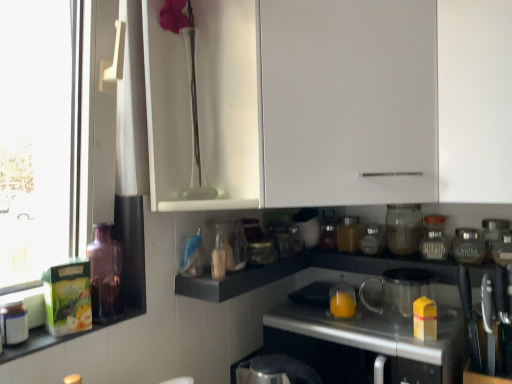
Question: Is translucent glass jar at center, positioned as the 4th bottle in left-to-right order, bigger or smaller than transparent glass jar at lower center, the fourth appliance viewed from the left?

Choices:
 (A) small
 (B) big

Answer: (A)

Question: From a real-world perspective, is translucent glass jar at center, which is the 3th bottle in right-to-left order, physically located above or below transparent glass jar at lower center, the third appliance when ordered from right to left?

Choices:
 (A) above
 (B) below

Answer: (B)

Question: Which is farther from the translucent glass jar at center, positioned as the 4th bottle in left-to-right order?

Choices:
 (A) translucent glass jar at center, acting as the first bottle starting from the back
 (B) matte glass jar at center-right, which appears as the second bottle when viewed from the right
 (C) metallic silver canister at right, which is the 2th appliance in right-to-left order
 (D) transparent glass vase at upper center, acting as the second cabinetry starting from the back
 (E) metallic silver countertop at center

Answer: (D)

Question: Which object is positioned farthest from the white glossy jar at lower left, the sixth bottle viewed from the right?

Choices:
 (A) metallic silver canisters at lower right, acting as the sixth appliance starting from the left
 (B) translucent glass bottle at left, which is the second bottle in left-to-right order
 (C) black matte shelf at center
 (D) translucent glass blender at lower center, the fourth appliance viewed from the right
 (E) transparent glass vase at upper center, acting as the second cabinetry starting from the back

Answer: (A)